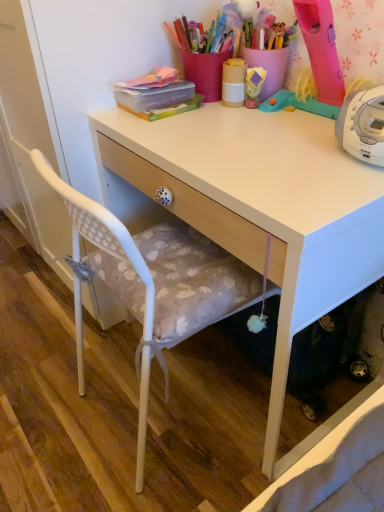
Find the location of a particular element. This screenshot has height=512, width=384. free region on the left part of matte yellow cup at upper center is located at coordinates (176, 118).